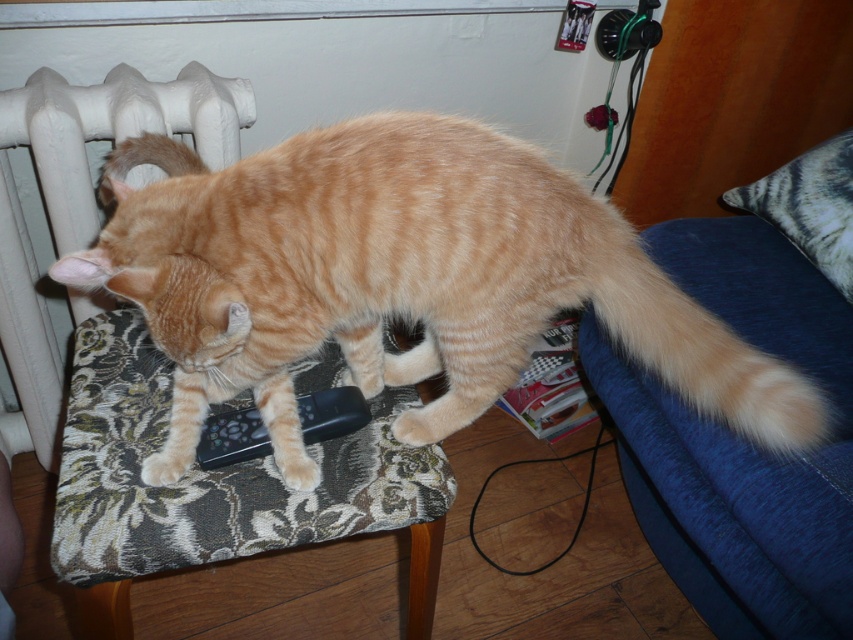
Is white matte radiator at upper left behind light brown fur paw at center?

Yes, white matte radiator at upper left is behind light brown fur paw at center.

Is white matte radiator at upper left positioned before light brown fur paw at center?

No.

Is point (242, 93) closer to camera compared to point (289, 464)?

No, it is not.

Where is `white matte radiator at upper left`? The height and width of the screenshot is (640, 853). white matte radiator at upper left is located at coordinates (83, 200).

Between black plastic remote at center and orange fur paw at lower left, which one is positioned lower?

orange fur paw at lower left

Measure the distance between black plastic remote at center and orange fur paw at lower left.

black plastic remote at center is 3.88 inches away from orange fur paw at lower left.

The height and width of the screenshot is (640, 853). Describe the element at coordinates (231, 438) in the screenshot. I see `black plastic remote at center` at that location.

You are a GUI agent. You are given a task and a screenshot of the screen. Output one action in this format:
    pyautogui.click(x=<x>, y=<y>)
    Task: Click on the black plastic remote at center
    This screenshot has width=853, height=640.
    Given the screenshot: What is the action you would take?
    pyautogui.click(x=231, y=438)

You are a GUI agent. You are given a task and a screenshot of the screen. Output one action in this format:
    pyautogui.click(x=<x>, y=<y>)
    Task: Click on the orange striped fur cat at center
    This screenshot has height=640, width=853.
    Given the screenshot: What is the action you would take?
    pyautogui.click(x=403, y=275)

Between orange striped fur cat at center and orange fur paw at lower left, which one appears on the left side from the viewer's perspective?

Positioned to the left is orange fur paw at lower left.

Is point (445, 348) positioned before point (151, 458)?

No, it is not.

Find the location of a particular element. This screenshot has width=853, height=640. orange striped fur cat at center is located at coordinates point(403,275).